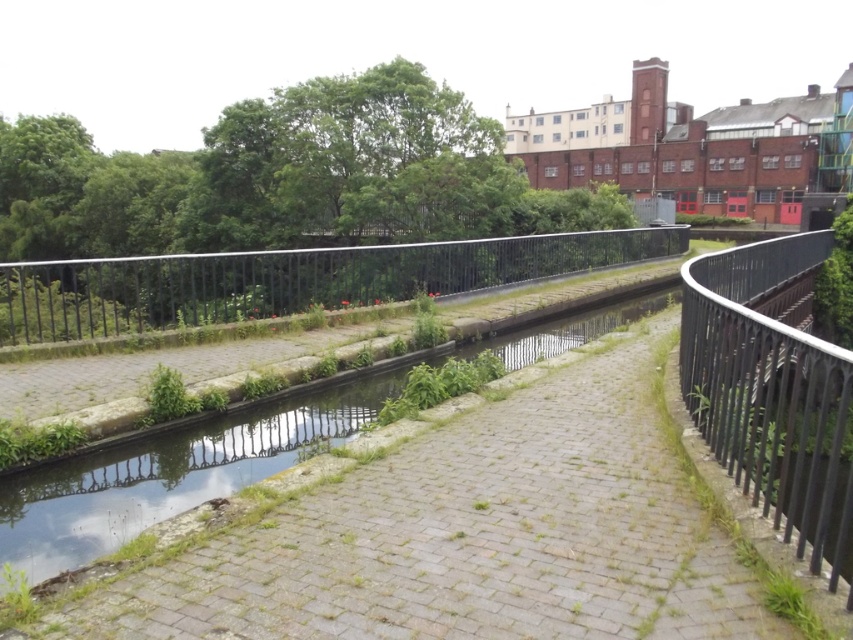
The width and height of the screenshot is (853, 640). Describe the element at coordinates (457, 531) in the screenshot. I see `brick paved path at center` at that location.

Is brick paved path at center smaller than black metal fence at right?

Yes, brick paved path at center is smaller than black metal fence at right.

Where is `brick paved path at center`? The width and height of the screenshot is (853, 640). brick paved path at center is located at coordinates (457, 531).

At what (x,y) coordinates should I click in order to perform the action: click on brick paved path at center. Please return your answer as a coordinate pair (x, y). Looking at the image, I should click on (457, 531).

Is brick paved path at center below black metal fence at center?

Correct, brick paved path at center is located below black metal fence at center.

Between brick paved path at center and black metal fence at center, which one has more height?

With more height is black metal fence at center.

Does point (509, 408) come closer to viewer compared to point (489, 266)?

That is True.

At what (x,y) coordinates should I click in order to perform the action: click on brick paved path at center. Please return your answer as a coordinate pair (x, y). This screenshot has width=853, height=640. Looking at the image, I should click on (457, 531).

Is black metal fence at right bigger than black metal fence at center?

Incorrect, black metal fence at right is not larger than black metal fence at center.

Who is positioned more to the right, black metal fence at right or black metal fence at center?

black metal fence at right

Who is more distant from viewer, (781, 465) or (213, 298)?

Positioned behind is point (213, 298).

Find the location of a particular element. This screenshot has width=853, height=640. black metal fence at right is located at coordinates (772, 388).